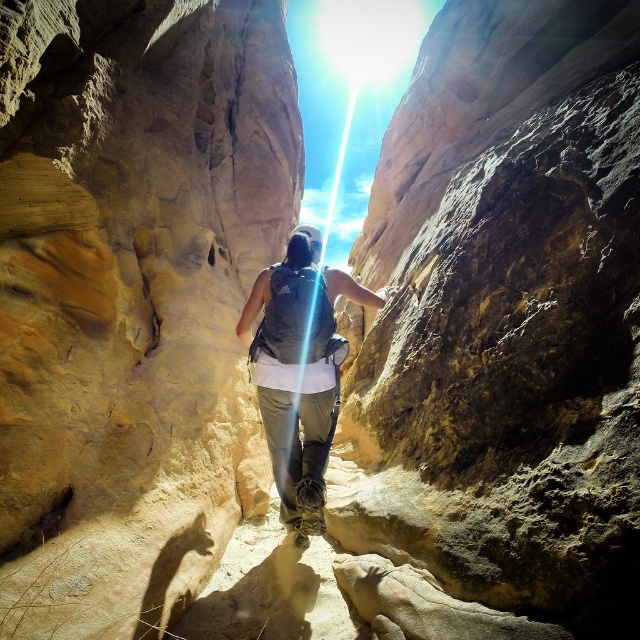
Question: Can you confirm if rustic sandstone boulder at center is positioned to the right of matte gray backpack at center?

Choices:
 (A) no
 (B) yes

Answer: (B)

Question: Which object appears closest to the camera in this image?

Choices:
 (A) matte gray backpack at center
 (B) rustic sandstone boulder at center
 (C) yellow sandstone rock face at center

Answer: (B)

Question: Which of the following is the closest to the observer?

Choices:
 (A) (573, 531)
 (B) (19, 120)
 (C) (273, 452)

Answer: (A)

Question: Can you confirm if rustic sandstone boulder at center is smaller than yellow sandstone rock face at center?

Choices:
 (A) yes
 (B) no

Answer: (B)

Question: Which object is the closest to the rustic sandstone boulder at center?

Choices:
 (A) matte gray backpack at center
 (B) yellow sandstone rock face at center

Answer: (A)

Question: From the image, what is the correct spatial relationship of rustic sandstone boulder at center in relation to yellow sandstone rock face at center?

Choices:
 (A) below
 (B) above

Answer: (B)